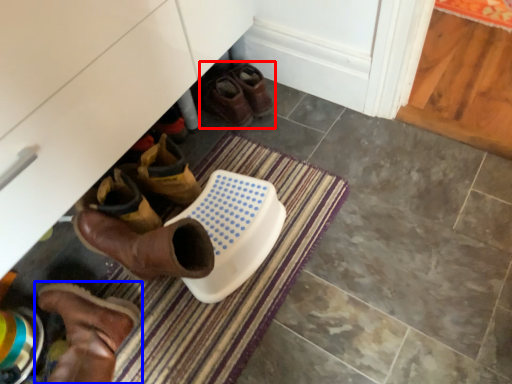
Question: Which object appears farthest to the camera in this image, footwear (highlighted by a red box) or footwear (highlighted by a blue box)?

Choices:
 (A) footwear
 (B) footwear

Answer: (A)